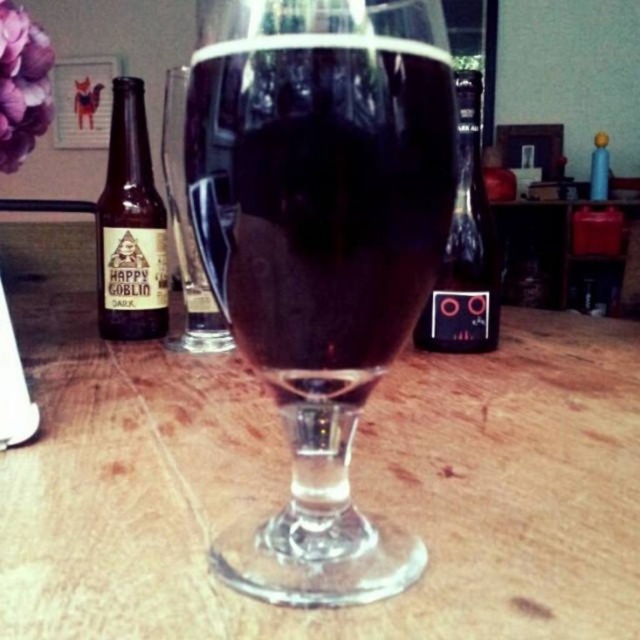
Question: Among these points, which one is nearest to the camera?

Choices:
 (A) (22, 76)
 (B) (157, 408)
 (C) (449, 150)
 (D) (104, 252)

Answer: (C)

Question: Which object appears farthest from the camera in this image?

Choices:
 (A) transparent glass at center
 (B) purple matte flower at upper left
 (C) wooden table at center
 (D) brown glass bottle at left

Answer: (D)

Question: Can you confirm if transparent glass at center is wider than black glass bottle at center?

Choices:
 (A) no
 (B) yes

Answer: (A)

Question: Can you confirm if brown glass bottle at left is positioned above black glass bottle at center?

Choices:
 (A) no
 (B) yes

Answer: (B)

Question: Estimate the real-world distances between objects in this image. Which object is closer to the brown glass bottle at left?

Choices:
 (A) purple matte flower at upper left
 (B) black glass bottle at center
 (C) wooden table at center

Answer: (A)

Question: Is wooden table at center to the right of brown glass bottle at left from the viewer's perspective?

Choices:
 (A) no
 (B) yes

Answer: (B)